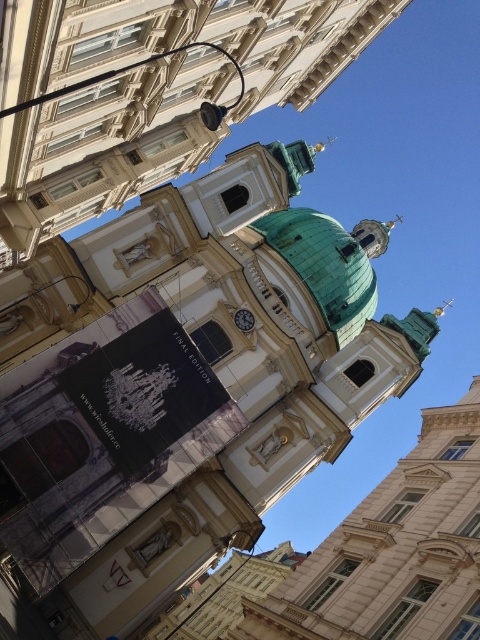
Question: Observing the image, what is the correct spatial positioning of green dome at center in reference to green copper dome at center?

Choices:
 (A) right
 (B) left

Answer: (B)

Question: Is green dome at center below white glossy clock at center?

Choices:
 (A) no
 (B) yes

Answer: (A)

Question: Which point is farther from the camera taking this photo?

Choices:
 (A) (153, 134)
 (B) (244, 317)

Answer: (B)

Question: Which point is closer to the camera?

Choices:
 (A) green dome at center
 (B) green copper dome at center
 (C) white glossy clock at center

Answer: (A)

Question: Can you confirm if green dome at center is wider than white glossy clock at center?

Choices:
 (A) no
 (B) yes

Answer: (B)

Question: Which point is farther to the camera?

Choices:
 (A) (352, 240)
 (B) (249, 330)
 (C) (62, 128)

Answer: (A)